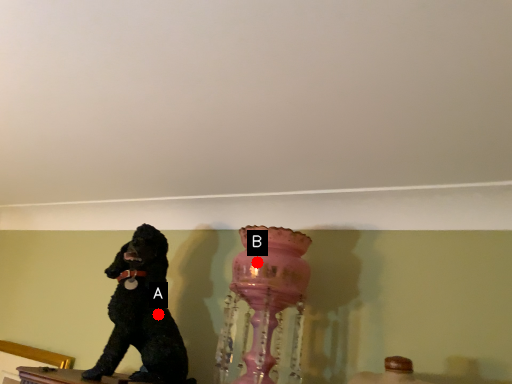
Question: Two points are circled on the image, labeled by A and B beside each circle. Which point appears farthest from the camera in this image?

Choices:
 (A) A is further
 (B) B is further

Answer: (A)